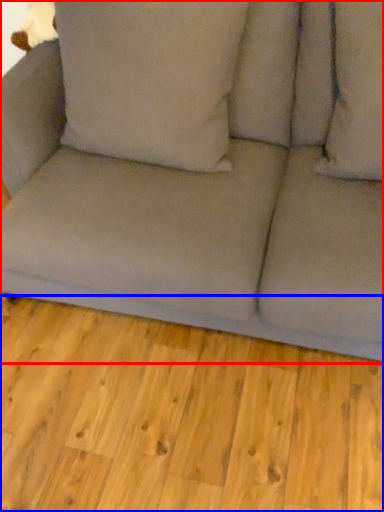
Question: Which object appears farthest to the camera in this image, studio couch (highlighted by a red box) or plank (highlighted by a blue box)?

Choices:
 (A) studio couch
 (B) plank

Answer: (B)